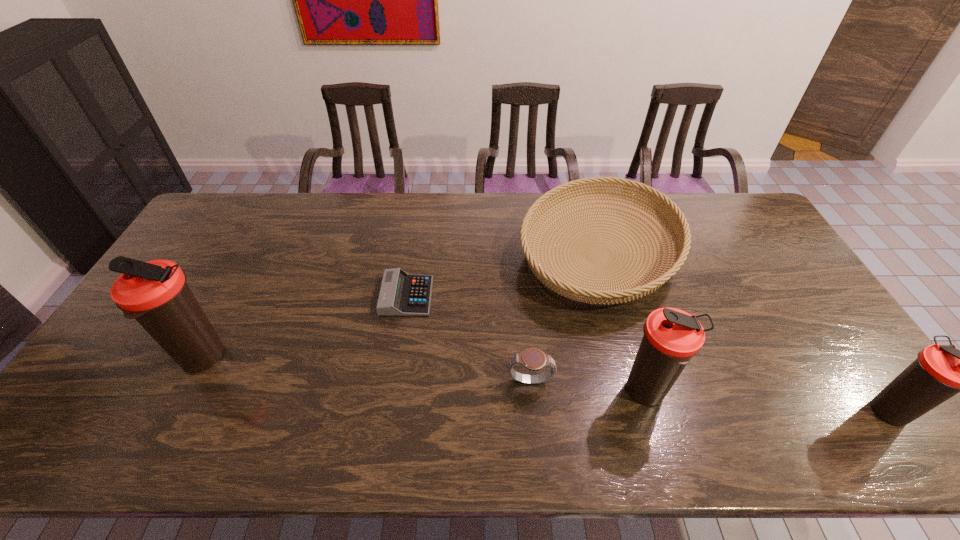
The height and width of the screenshot is (540, 960). Find the location of `unoccupied position between the second thermos bottle from right to left and the leftmost thermos bottle`. unoccupied position between the second thermos bottle from right to left and the leftmost thermos bottle is located at coordinates (425, 375).

At what (x,y) coordinates should I click in order to perform the action: click on free space that is in between the shortest thermos bottle and the basket. Please return your answer as a coordinate pair (x, y). Image resolution: width=960 pixels, height=540 pixels. Looking at the image, I should click on (745, 333).

Image resolution: width=960 pixels, height=540 pixels. Find the location of `unoccupied position between the basket and the watch`. unoccupied position between the basket and the watch is located at coordinates (564, 318).

I want to click on free space that is in between the basket and the third tallest object, so point(745,333).

Select which object is the third closest to the watch. Please provide its 2D coordinates. Your answer should be formatted as a tuple, i.e. [(x, y)], where the tuple contains the x and y coordinates of a point satisfying the conditions above.

[(401, 294)]

Image resolution: width=960 pixels, height=540 pixels. In order to click on object that is the second closest to the shortest object in this screenshot , I will do `click(533, 359)`.

This screenshot has width=960, height=540. I want to click on thermos bottle that is the closest to the shortest thermos bottle, so click(x=672, y=337).

Locate an element on the screen. Image resolution: width=960 pixels, height=540 pixels. thermos bottle that is the second closest to the shortest thermos bottle is located at coordinates (155, 293).

Where is `blank space that satisfies the following two spatial constraints: 1. on the back side of the basket; 2. on the left side of the watch`? The height and width of the screenshot is (540, 960). blank space that satisfies the following two spatial constraints: 1. on the back side of the basket; 2. on the left side of the watch is located at coordinates (518, 255).

Where is `free space that satisfies the following two spatial constraints: 1. on the back side of the basket; 2. on the right side of the watch`? Image resolution: width=960 pixels, height=540 pixels. free space that satisfies the following two spatial constraints: 1. on the back side of the basket; 2. on the right side of the watch is located at coordinates (518, 255).